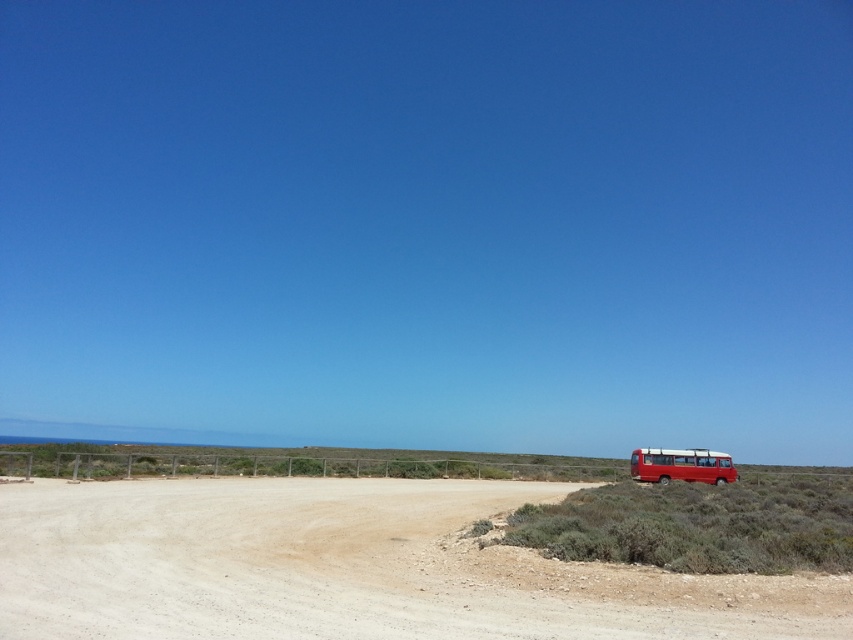
Question: Which is farther from the metallic red bus at right?

Choices:
 (A) green shrubbery at right
 (B) dirt field at lower right

Answer: (B)

Question: Is dirt field at lower right below green shrubbery at right?

Choices:
 (A) no
 (B) yes

Answer: (A)

Question: Can you confirm if dirt field at lower right is thinner than green shrubbery at right?

Choices:
 (A) yes
 (B) no

Answer: (A)

Question: Does dirt field at lower right come in front of green shrubbery at right?

Choices:
 (A) no
 (B) yes

Answer: (B)

Question: Which point is closer to the camera?

Choices:
 (A) metallic red bus at right
 (B) green shrubbery at right
 (C) dirt field at lower right

Answer: (C)

Question: Which point is farther from the camera taking this photo?

Choices:
 (A) (636, 476)
 (B) (544, 536)

Answer: (A)